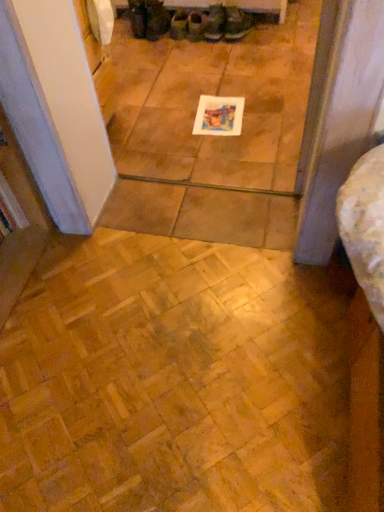
What are the coordinates of `green fabric shoe at upper center, the sixth footwear viewed from the left` in the screenshot? It's located at (237, 23).

Locate an element on the screen. The width and height of the screenshot is (384, 512). wooden parquet floor at lower left is located at coordinates (172, 381).

How much space does dark brown leather boot at upper center, which appears as the fifth footwear when viewed from the right, occupy horizontally?

dark brown leather boot at upper center, which appears as the fifth footwear when viewed from the right, is 9.51 inches in width.

The width and height of the screenshot is (384, 512). Describe the element at coordinates (137, 18) in the screenshot. I see `matte black shoes at upper center, the sixth footwear from the right` at that location.

Where is `white paper at center`? This screenshot has width=384, height=512. white paper at center is located at coordinates (219, 116).

The height and width of the screenshot is (512, 384). Describe the element at coordinates (179, 24) in the screenshot. I see `green canvas shoes at upper center, positioned as the 3th footwear in left-to-right order` at that location.

Find the location of a particular element. The width and height of the screenshot is (384, 512). leather boot at center, the 5th footwear when ordered from left to right is located at coordinates (214, 23).

Visually, is matte black shoes at upper center, the sixth footwear from the right, positioned to the left or to the right of green canvas shoes at upper center, arranged as the 4th footwear when viewed from the right?

In the image, matte black shoes at upper center, the sixth footwear from the right, appears on the left side of green canvas shoes at upper center, arranged as the 4th footwear when viewed from the right.

Which footwear is the 1st one when counting from the front of the green canvas shoes at upper center, arranged as the 4th footwear when viewed from the right? Please provide its 2D coordinates.

[(137, 18)]

Does matte black shoes at upper center, the 1th footwear from the left, have a greater height compared to green canvas shoes at upper center, positioned as the 3th footwear in left-to-right order?

Yes.

Looking at this image, how far apart are matte black shoes at upper center, the sixth footwear from the right, and green canvas shoes at upper center, arranged as the 4th footwear when viewed from the right?

matte black shoes at upper center, the sixth footwear from the right, and green canvas shoes at upper center, arranged as the 4th footwear when viewed from the right, are 19.69 centimeters apart.

Are green fabric shoe at upper center, the sixth footwear viewed from the left, and leather boot at center, the second footwear viewed from the right, beside each other?

Yes, green fabric shoe at upper center, the sixth footwear viewed from the left, is beside leather boot at center, the second footwear viewed from the right.

Who is taller, green fabric shoe at upper center, the sixth footwear viewed from the left, or leather boot at center, the 5th footwear when ordered from left to right?

leather boot at center, the 5th footwear when ordered from left to right.

Locate an element on the screen. footwear on the right of leather boot at center, the 5th footwear when ordered from left to right is located at coordinates (237, 23).

Is green fabric shoe at upper center, positioned as the 1th footwear in right-to-left order, further to the viewer compared to leather boot at center, the 5th footwear when ordered from left to right?

No, green fabric shoe at upper center, positioned as the 1th footwear in right-to-left order, is in front of leather boot at center, the 5th footwear when ordered from left to right.

The image size is (384, 512). What are the coordinates of `postcard on the left side of leather boot at center, the second footwear viewed from the right` in the screenshot? It's located at (219, 116).

Who is shorter, leather boot at center, the second footwear viewed from the right, or white paper at center?

Standing shorter between the two is white paper at center.

Which of these two, leather boot at center, the 5th footwear when ordered from left to right, or white paper at center, is bigger?

With larger size is leather boot at center, the 5th footwear when ordered from left to right.

Can you confirm if leather boot at center, the second footwear viewed from the right, is wider than white paper at center?

No, leather boot at center, the second footwear viewed from the right, is not wider than white paper at center.

Is point (222, 389) positioned after point (219, 5)?

No.

From the picture: From the image's perspective, does wooden parquet floor at lower left appear higher than leather boot at center, the 5th footwear when ordered from left to right?

No, from the image's perspective, wooden parquet floor at lower left is not on top of leather boot at center, the 5th footwear when ordered from left to right.

Which point is more distant from viewer, (151,23) or (191,35)?

The point (151,23) is more distant.

Which is in front, dark brown leather boot at upper center, the 2th footwear in the left-to-right sequence, or matte green fabric shoe at center, which ranks as the 3th footwear in right-to-left order?

dark brown leather boot at upper center, the 2th footwear in the left-to-right sequence, is more forward.

Are dark brown leather boot at upper center, which appears as the fifth footwear when viewed from the right, and matte green fabric shoe at center, which ranks as the 3th footwear in right-to-left order, located far from each other?

No, dark brown leather boot at upper center, which appears as the fifth footwear when viewed from the right, is in close proximity to matte green fabric shoe at center, which ranks as the 3th footwear in right-to-left order.

How much distance is there between white paper at center and green fabric shoe at upper center, the sixth footwear viewed from the left?

white paper at center and green fabric shoe at upper center, the sixth footwear viewed from the left, are 26.94 inches apart from each other.

Who is more distant, white paper at center or green fabric shoe at upper center, the sixth footwear viewed from the left?

green fabric shoe at upper center, the sixth footwear viewed from the left, is further away from the camera.

Considering the points (197, 117) and (250, 27), which point is in front, point (197, 117) or point (250, 27)?

The point (197, 117) is closer to the camera.

Which object is wider, white paper at center or green fabric shoe at upper center, positioned as the 1th footwear in right-to-left order?

white paper at center is wider.

Is white paper at center positioned with its back to matte black shoes at upper center, the sixth footwear from the right?

white paper at center is not turned away from matte black shoes at upper center, the sixth footwear from the right.

Based on the photo, can you confirm if white paper at center is wider than matte black shoes at upper center, the sixth footwear from the right?

Yes, white paper at center is wider than matte black shoes at upper center, the sixth footwear from the right.

From a real-world perspective, is white paper at center above or below matte black shoes at upper center, the sixth footwear from the right?

In terms of real-world spatial position, white paper at center is below matte black shoes at upper center, the sixth footwear from the right.

Looking at this image, are white paper at center and matte black shoes at upper center, the 1th footwear from the left, far apart?

No, white paper at center is not far from matte black shoes at upper center, the 1th footwear from the left.

From a real-world perspective, count 4th footwears upward from the green canvas shoes at upper center, arranged as the 4th footwear when viewed from the right, and point to it. Please provide its 2D coordinates.

[(137, 18)]

At what (x,y) coordinates should I click in order to perform the action: click on footwear on the right of leather boot at center, the 5th footwear when ordered from left to right. Please return your answer as a coordinate pair (x, y). The width and height of the screenshot is (384, 512). Looking at the image, I should click on (237, 23).

Estimate the real-world distances between objects in this image. Which object is further from green canvas shoes at upper center, positioned as the 3th footwear in left-to-right order, matte black shoes at upper center, the sixth footwear from the right, or matte green fabric shoe at center, marked as the fourth footwear in a left-to-right arrangement?

The object further to green canvas shoes at upper center, positioned as the 3th footwear in left-to-right order, is matte black shoes at upper center, the sixth footwear from the right.

Looking at the image, which one is located closer to green fabric shoe at upper center, the sixth footwear viewed from the left, dark brown leather boot at upper center, the 2th footwear in the left-to-right sequence, or matte green fabric shoe at center, marked as the fourth footwear in a left-to-right arrangement?

matte green fabric shoe at center, marked as the fourth footwear in a left-to-right arrangement, lies closer to green fabric shoe at upper center, the sixth footwear viewed from the left, than the other object.

From the image, which object appears to be farther from dark brown leather boot at upper center, which appears as the fifth footwear when viewed from the right, green fabric shoe at upper center, positioned as the 1th footwear in right-to-left order, or white paper at center?

Based on the image, white paper at center appears to be further to dark brown leather boot at upper center, which appears as the fifth footwear when viewed from the right.

When comparing their distances from leather boot at center, the 5th footwear when ordered from left to right, does white paper at center or matte green fabric shoe at center, which ranks as the 3th footwear in right-to-left order, seem closer?

matte green fabric shoe at center, which ranks as the 3th footwear in right-to-left order, lies closer to leather boot at center, the 5th footwear when ordered from left to right, than the other object.

Considering their positions, is leather boot at center, the second footwear viewed from the right, positioned closer to matte black shoes at upper center, the 1th footwear from the left, than wooden parquet floor at lower left?

leather boot at center, the second footwear viewed from the right, is closer to matte black shoes at upper center, the 1th footwear from the left.

Based on their spatial positions, is green fabric shoe at upper center, positioned as the 1th footwear in right-to-left order, or dark brown leather boot at upper center, which appears as the fifth footwear when viewed from the right, further from white paper at center?

dark brown leather boot at upper center, which appears as the fifth footwear when viewed from the right, is positioned further to the anchor white paper at center.

Which object lies further to the anchor point matte black shoes at upper center, the sixth footwear from the right, white paper at center or leather boot at center, the 5th footwear when ordered from left to right?

white paper at center.

Estimate the real-world distances between objects in this image. Which object is closer to green fabric shoe at upper center, positioned as the 1th footwear in right-to-left order, leather boot at center, the 5th footwear when ordered from left to right, or matte black shoes at upper center, the 1th footwear from the left?

leather boot at center, the 5th footwear when ordered from left to right, is positioned closer to the anchor green fabric shoe at upper center, positioned as the 1th footwear in right-to-left order.

The width and height of the screenshot is (384, 512). In order to click on postcard between leather boot at center, the second footwear viewed from the right, and wooden parquet floor at lower left, in the vertical direction in this screenshot , I will do `click(219, 116)`.

The height and width of the screenshot is (512, 384). Identify the location of footwear between green canvas shoes at upper center, positioned as the 3th footwear in left-to-right order, and leather boot at center, the second footwear viewed from the right, in the horizontal direction. (195, 25).

This screenshot has height=512, width=384. In order to click on postcard that lies between dark brown leather boot at upper center, the 2th footwear in the left-to-right sequence, and wooden parquet floor at lower left from top to bottom in this screenshot , I will do `click(219, 116)`.

At what (x,y) coordinates should I click in order to perform the action: click on postcard between matte black shoes at upper center, the sixth footwear from the right, and wooden parquet floor at lower left vertically. Please return your answer as a coordinate pair (x, y). Image resolution: width=384 pixels, height=512 pixels. Looking at the image, I should click on (219, 116).